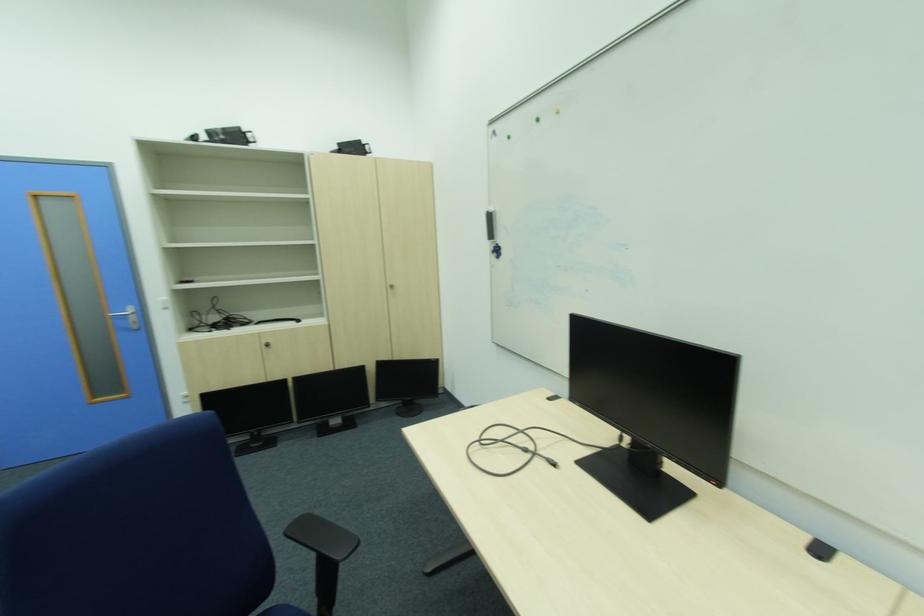
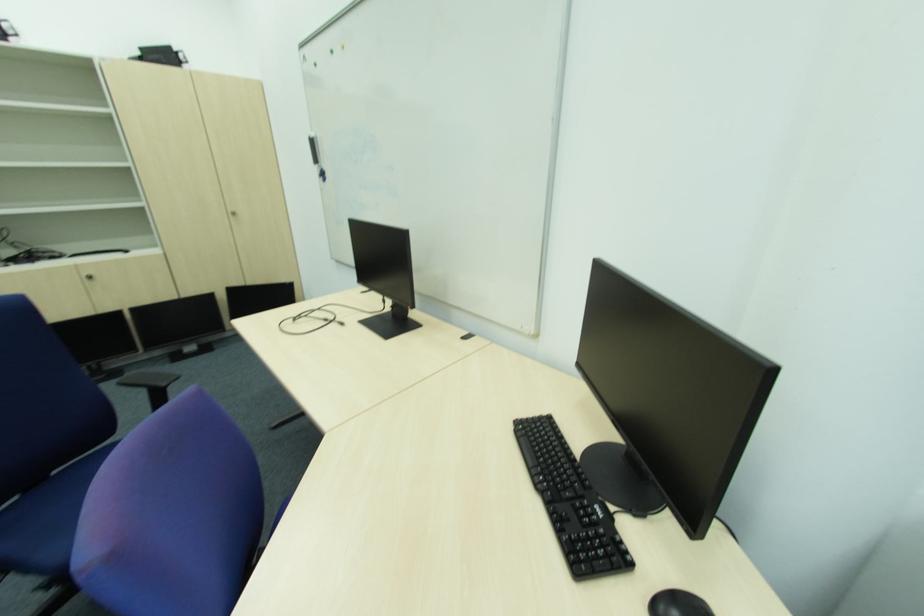
What movement of the cameraman would produce the second image?

The movement direction of the cameraman is right, backward.